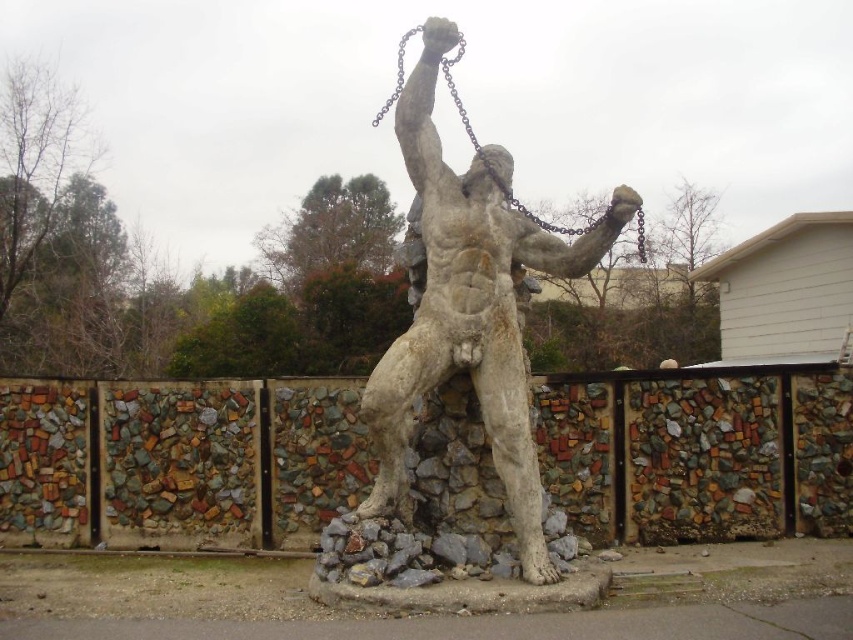
Looking at this image, which is more to the left, stained glass mosaic fence at center or dark gray metallic chain at upper center?

Positioned to the left is stained glass mosaic fence at center.

Consider the image. Measure the distance between stained glass mosaic fence at center and camera.

7.60 meters

The height and width of the screenshot is (640, 853). In order to click on stained glass mosaic fence at center in this screenshot , I will do `click(178, 460)`.

Where is `stained glass mosaic fence at center`? stained glass mosaic fence at center is located at coordinates (178, 460).

Does white stone statue at center appear over dark gray metallic chain at upper center?

Incorrect, white stone statue at center is not positioned above dark gray metallic chain at upper center.

Does point (383, 396) come farther from viewer compared to point (393, 100)?

No, it is in front of (393, 100).

Between point (410, 403) and point (460, 38), which one is positioned in front?

Point (410, 403)

I want to click on white stone statue at center, so click(x=469, y=307).

Who is lower down, stained glass mosaic fence at center or white stone statue at center?

Positioned lower is stained glass mosaic fence at center.

Is stained glass mosaic fence at center to the right of white stone statue at center from the viewer's perspective?

No, stained glass mosaic fence at center is not to the right of white stone statue at center.

Is point (26, 442) farther from camera compared to point (448, 275)?

Yes, point (26, 442) is behind point (448, 275).

Image resolution: width=853 pixels, height=640 pixels. I want to click on stained glass mosaic fence at center, so click(178, 460).